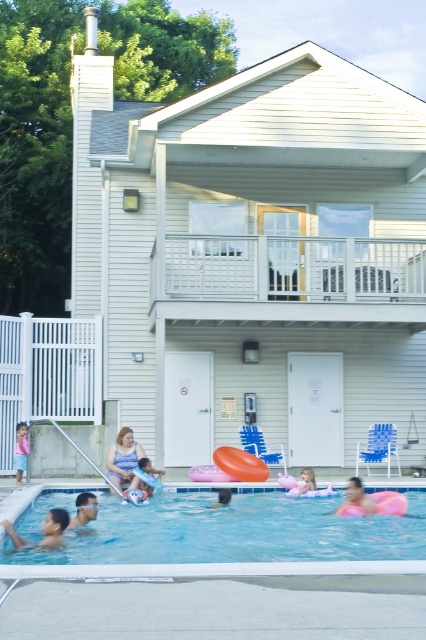
Does light blue denim shorts at lower left appear on the right side of pink rubber ring at lower center?

No, light blue denim shorts at lower left is not to the right of pink rubber ring at lower center.

Is light blue denim shorts at lower left taller than pink rubber ring at lower center?

Indeed, light blue denim shorts at lower left has a greater height compared to pink rubber ring at lower center.

What do you see at coordinates (20, 451) in the screenshot?
I see `light blue denim shorts at lower left` at bounding box center [20, 451].

You are a GUI agent. You are given a task and a screenshot of the screen. Output one action in this format:
    pyautogui.click(x=<x>, y=<y>)
    Task: Click on the light blue denim shorts at lower left
    The height and width of the screenshot is (640, 426).
    Given the screenshot: What is the action you would take?
    pyautogui.click(x=20, y=451)

Based on the photo, who is shorter, pink rubber ring at center or smooth skin face at lower left?

smooth skin face at lower left is shorter.

Which is behind, point (333, 509) or point (92, 509)?

The point (333, 509) is behind.

This screenshot has width=426, height=640. What are the coordinates of `pink rubber ring at center` in the screenshot? It's located at (356, 499).

Who is shorter, transparent blue water at lower center or light blue denim shorts at lower left?

Standing shorter between the two is transparent blue water at lower center.

How distant is transparent blue water at lower center from light blue denim shorts at lower left?

transparent blue water at lower center and light blue denim shorts at lower left are 4.05 meters apart from each other.

Is point (356, 561) positioned after point (19, 468)?

That is False.

Where is `transparent blue water at lower center`? The width and height of the screenshot is (426, 640). transparent blue water at lower center is located at coordinates (227, 541).